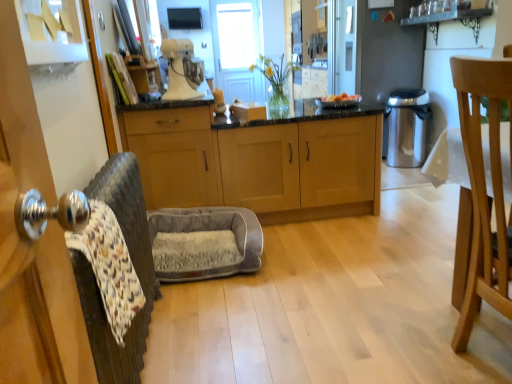
Find the location of a particular element. The height and width of the screenshot is (384, 512). vacant point to the right of gray plush pet bed at center, which ranks as the second swivel chair in front-to-back order is located at coordinates click(306, 254).